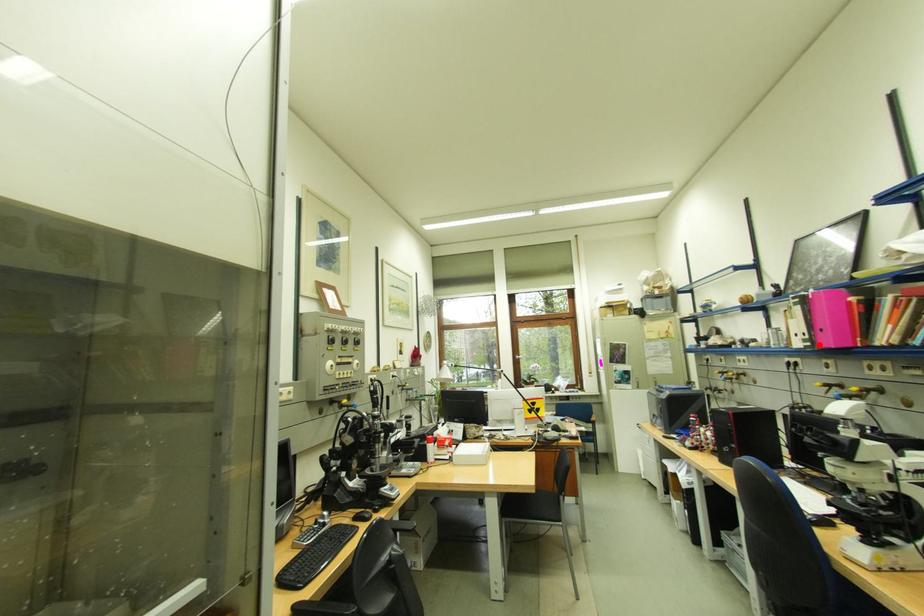
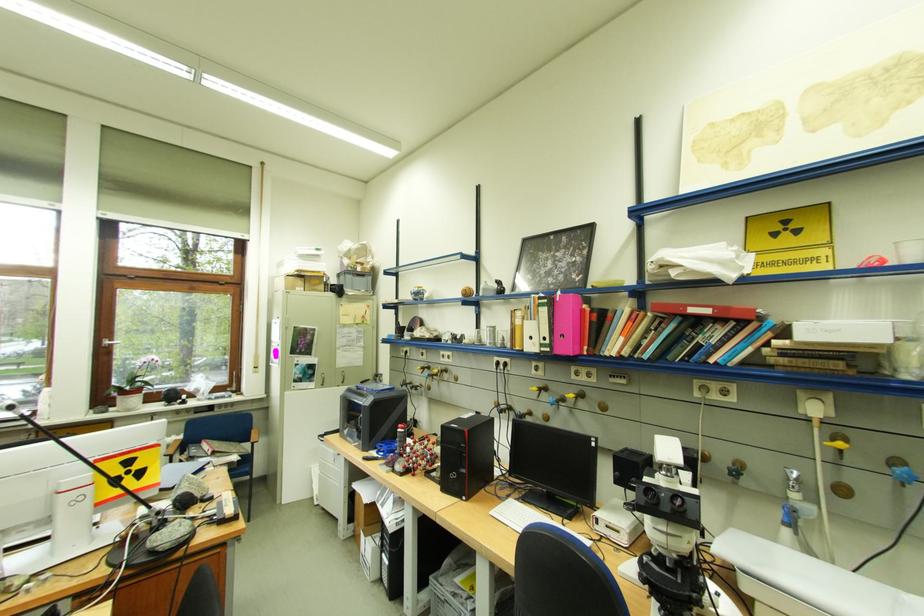
The point at the highlighted location is marked in the first image. Where is the corresponding point in the second image?

(558, 351)